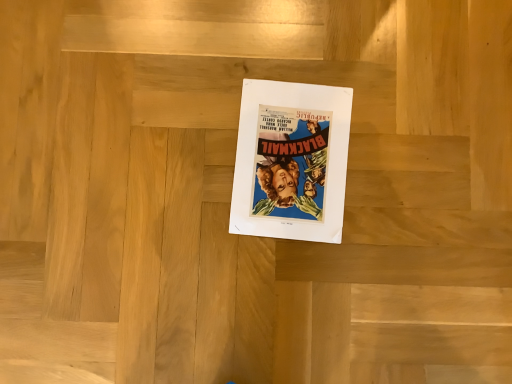
The image size is (512, 384). I want to click on free region under matte paper poster at center (from a real-world perspective), so click(x=293, y=165).